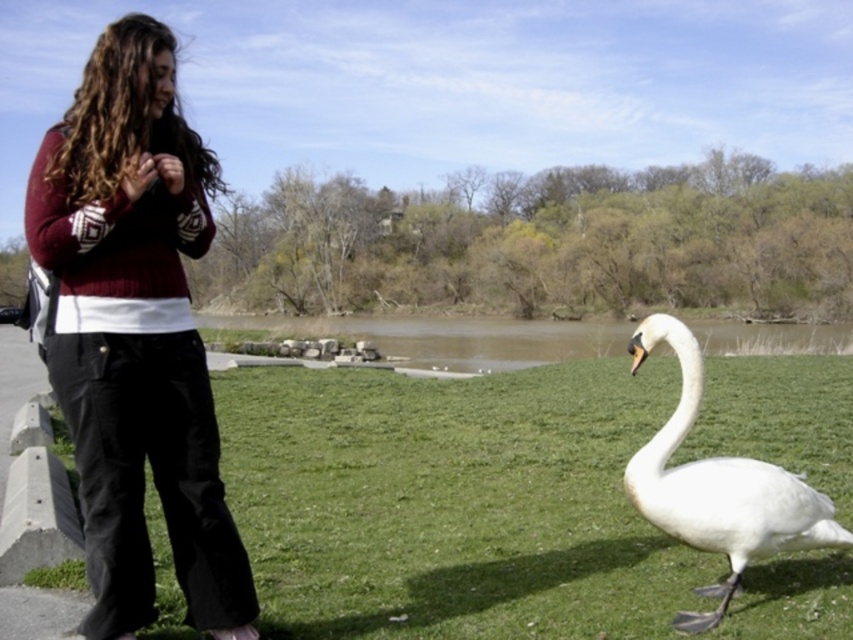
Question: Which of the following is the closest to the observer?

Choices:
 (A) green grass at lower center
 (B) brown water at center

Answer: (A)

Question: Which is farther from the white glossy swan at lower right?

Choices:
 (A) brown water at center
 (B) maroon sweater at upper left
 (C) green grass at lower center

Answer: (A)

Question: Observing the image, what is the correct spatial positioning of maroon sweater at upper left in reference to white glossy swan at lower right?

Choices:
 (A) above
 (B) below

Answer: (A)

Question: Is white glossy swan at lower right below brown water at center?

Choices:
 (A) no
 (B) yes

Answer: (B)

Question: Can you confirm if maroon sweater at upper left is bigger than brown water at center?

Choices:
 (A) yes
 (B) no

Answer: (B)

Question: Among these points, which one is farthest from the camera?

Choices:
 (A) (450, 602)
 (B) (746, 353)
 (C) (792, 486)
 (D) (178, 324)

Answer: (B)